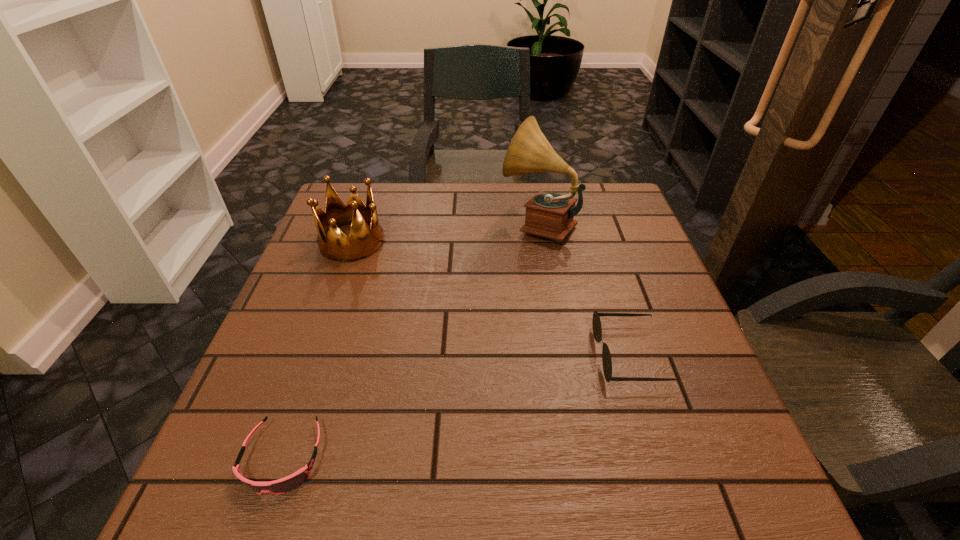
At what (x,y) coordinates should I click in order to perform the action: click on phonograph record. Please return your answer as a coordinate pair (x, y). This screenshot has width=960, height=540. Looking at the image, I should click on (550, 215).

Where is `crown`? crown is located at coordinates point(334,244).

Find the location of a particular element. This screenshot has height=540, width=960. sunglasses is located at coordinates (596, 322).

This screenshot has width=960, height=540. Find the location of `the second nearest object`. the second nearest object is located at coordinates (596, 322).

Where is `the shortest object`? the shortest object is located at coordinates (286, 484).

This screenshot has width=960, height=540. What are the coordinates of `goggles` in the screenshot? It's located at (286, 484).

Identify the location of free location located on the horn of the phonograph record. tap(455, 224).

Image resolution: width=960 pixels, height=540 pixels. Find the location of `free space located on the horn of the phonograph record`. free space located on the horn of the phonograph record is located at coordinates pyautogui.click(x=414, y=224).

This screenshot has height=540, width=960. What are the coordinates of `free space located 0.300m on the horn of the phonograph record` in the screenshot? It's located at (388, 224).

The width and height of the screenshot is (960, 540). Identify the location of vacant space situated 0.260m on the right of the crown. (486, 241).